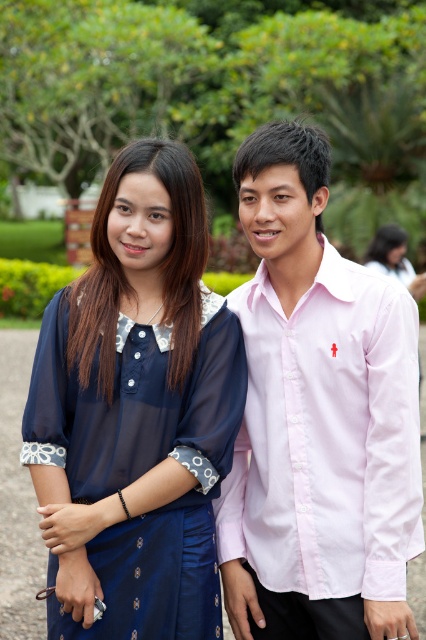
Is point (299, 273) positioned after point (36, 392)?

Yes, point (299, 273) is behind point (36, 392).

Describe the element at coordinates (317, 419) in the screenshot. The image size is (426, 640). I see `pink cotton shirt at center` at that location.

Does point (267, 280) come in front of point (192, 529)?

No, (267, 280) is behind (192, 529).

Where is `pink cotton shirt at center`? This screenshot has width=426, height=640. pink cotton shirt at center is located at coordinates (317, 419).